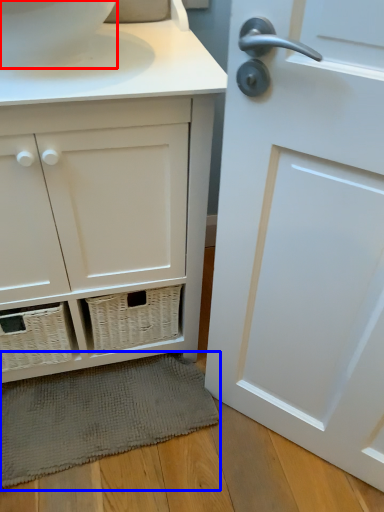
Question: Which of the following is the farthest to the observer, toilet bowl (highlighted by a red box) or bath mat (highlighted by a blue box)?

Choices:
 (A) toilet bowl
 (B) bath mat

Answer: (B)